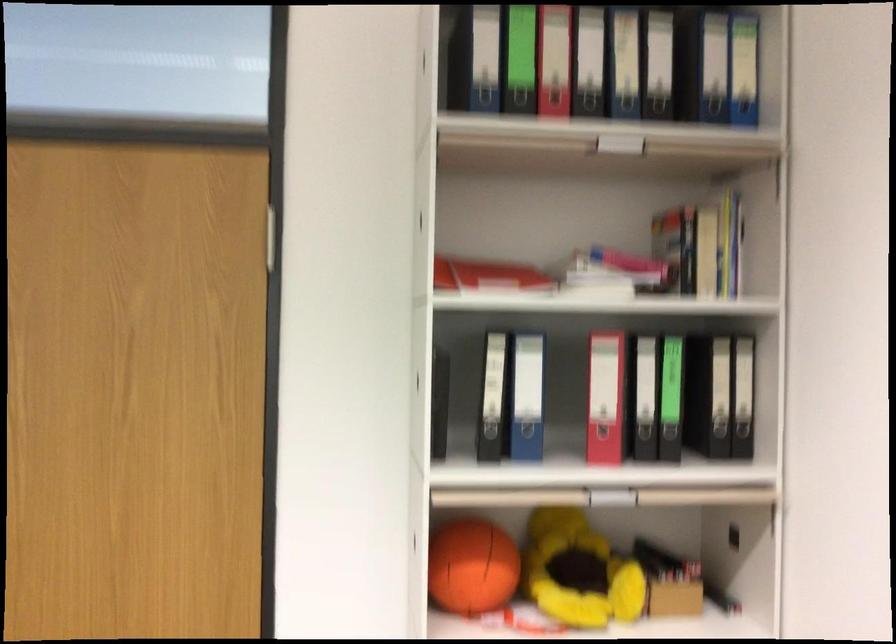
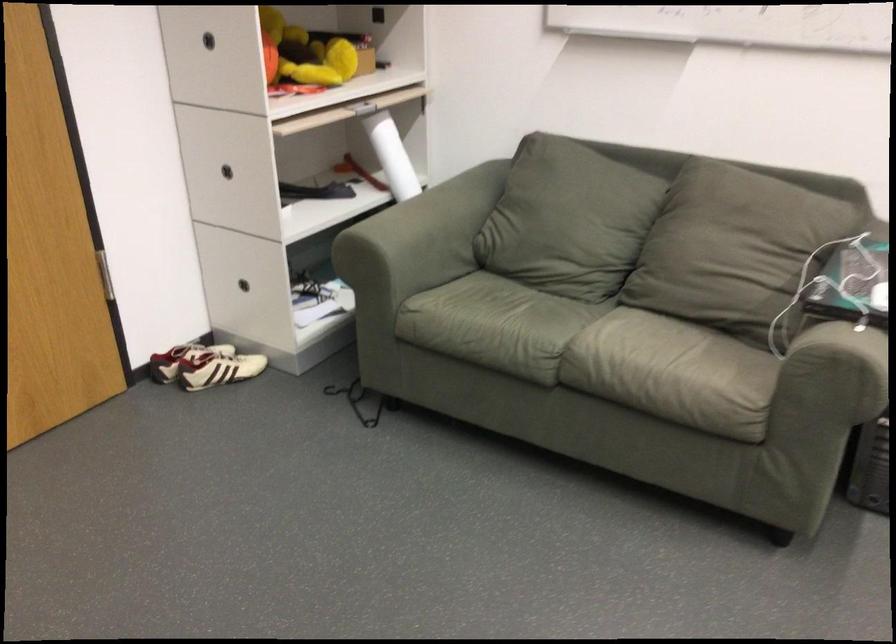
Find the pixel in the second image that matches the point at 590,562 in the first image.

(303, 53)